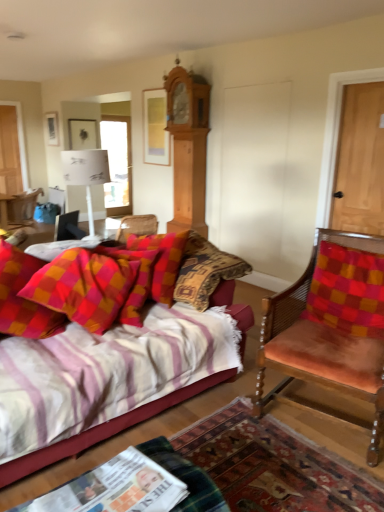
Question: Looking at the image, does plush cotton pillow at center-left, the first pillow viewed from the left, seem bigger or smaller compared to light brown wood clock at upper center?

Choices:
 (A) small
 (B) big

Answer: (A)

Question: Is point (119, 278) closer or farther from the camera than point (190, 118)?

Choices:
 (A) closer
 (B) farther

Answer: (A)

Question: Which object is the closest to the velvet pink chair at left, the 1th chair from the top?

Choices:
 (A) black plastic phone at lower left
 (B) light brown wood door at right, the second door in the back-to-front sequence
 (C) checkered fabric pillow at right, positioned as the second pillow in left-to-right order
 (D) white paper lampshade at upper center
 (E) striped fabric couch at lower left

Answer: (A)

Question: Which is farther from the light brown wood door at right, which is counted as the second door, starting from the left?

Choices:
 (A) plush cotton pillow at center-left, the first pillow viewed from the left
 (B) striped fabric couch at lower left
 (C) velvet orange chair at right, placed as the first chair when sorted from front to back
 (D) light brown wood clock at upper center
 (E) velvet pink chair at left, positioned as the first chair in left-to-right order

Answer: (E)